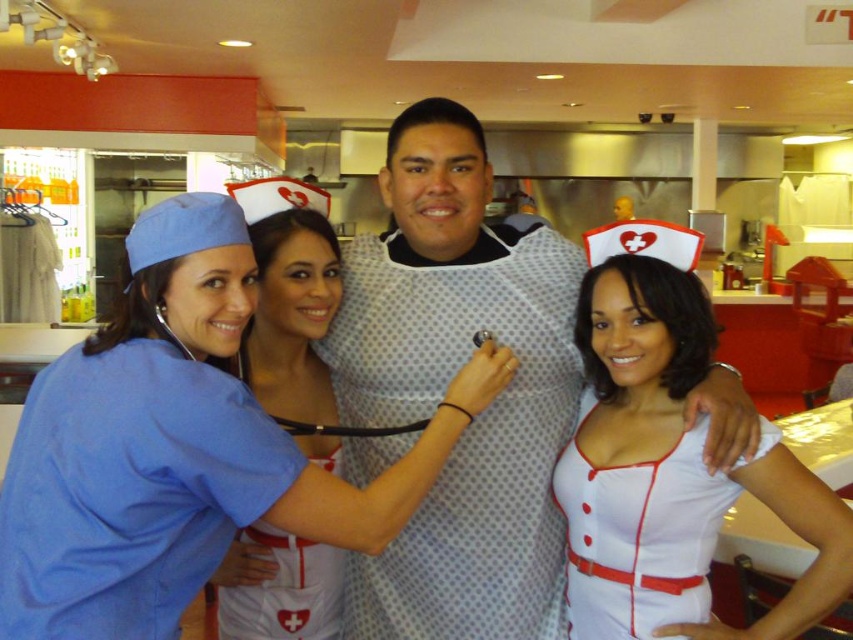
Is point (483, 380) positioned before point (550, 260)?

That is True.

Is the position of blue fabric nurse uniform at center more distant than that of white dotted shirt at center?

No, it is not.

Consider the image. Who is more distant from viewer, (94, 468) or (459, 531)?

Positioned behind is point (459, 531).

You are a GUI agent. You are given a task and a screenshot of the screen. Output one action in this format:
    pyautogui.click(x=<x>, y=<y>)
    Task: Click on the blue fabric nurse uniform at center
    The height and width of the screenshot is (640, 853).
    Given the screenshot: What is the action you would take?
    pos(178,448)

Can you confirm if white dotted shirt at center is positioned to the right of white fabric apron at center?

Indeed, white dotted shirt at center is positioned on the right side of white fabric apron at center.

Does white dotted shirt at center have a smaller size compared to white fabric apron at center?

No.

Between point (525, 628) and point (293, 634), which one is positioned behind?

The point (525, 628) is behind.

The height and width of the screenshot is (640, 853). Find the location of `white dotted shirt at center`. white dotted shirt at center is located at coordinates (445, 387).

Which is behind, point (407, 467) or point (624, 545)?

Point (624, 545)

Which is in front, point (55, 554) or point (640, 627)?

Positioned in front is point (55, 554).

Is point (177, 595) positioned in front of point (628, 497)?

Yes, it is.

Identify the location of blue fabric nurse uniform at center. The image size is (853, 640). (178, 448).